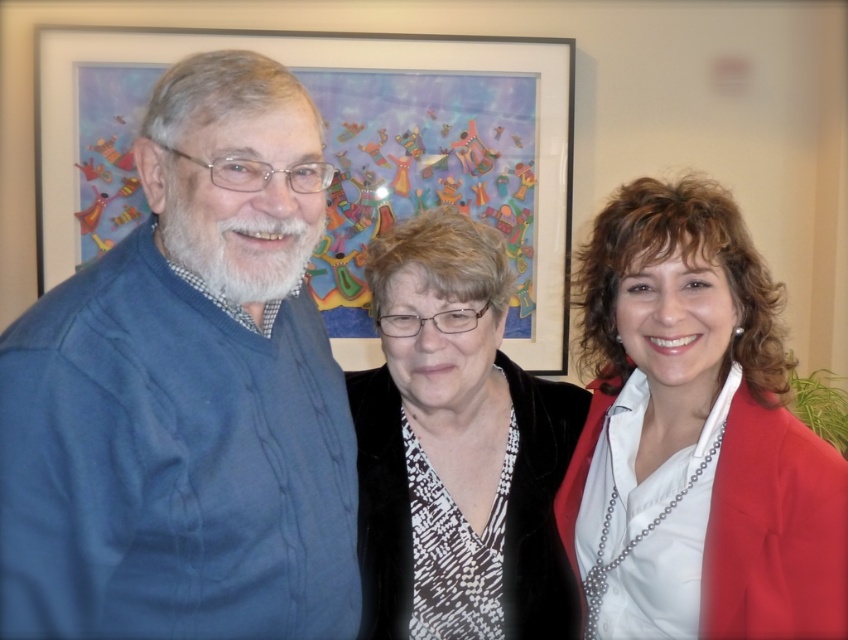
Question: Which of the following is the closest to the observer?

Choices:
 (A) (238, 504)
 (B) (193, 29)

Answer: (A)

Question: Which point is closer to the camera taking this photo?

Choices:
 (A) (501, 381)
 (B) (551, 234)

Answer: (A)

Question: Is corduroy sweater at left further to camera compared to wooden picture frame at upper center?

Choices:
 (A) no
 (B) yes

Answer: (A)

Question: Is corduroy sweater at left to the left of velvet black jacket at center from the viewer's perspective?

Choices:
 (A) yes
 (B) no

Answer: (A)

Question: Is wooden picture frame at upper center thinner than velvet black jacket at center?

Choices:
 (A) no
 (B) yes

Answer: (A)

Question: Which object is positioned closest to the wooden picture frame at upper center?

Choices:
 (A) corduroy sweater at left
 (B) white glossy shirt at center
 (C) velvet black jacket at center

Answer: (C)